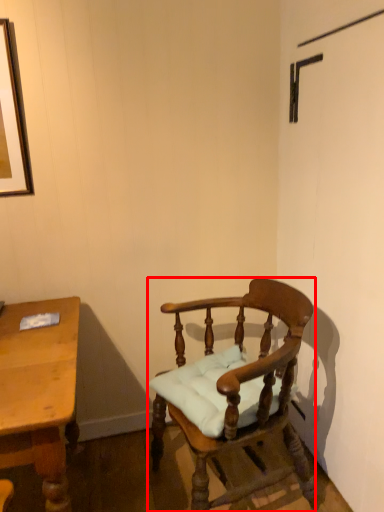
Question: From the image's perspective, where is chair (annotated by the red box) located relative to desk?

Choices:
 (A) above
 (B) below

Answer: (A)